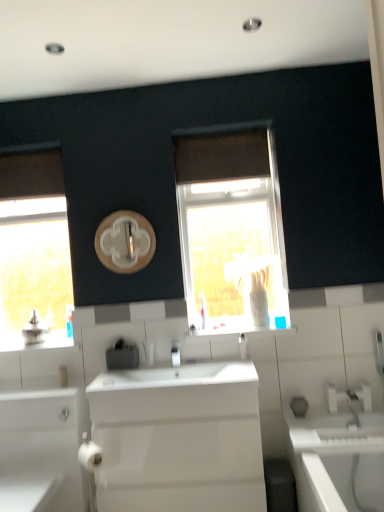
Question: Does white glossy window sill at center have a larger size compared to white glossy bathtub at lower right?

Choices:
 (A) no
 (B) yes

Answer: (A)

Question: From the image's perspective, is white glossy window sill at center beneath white glossy bathtub at lower right?

Choices:
 (A) yes
 (B) no

Answer: (B)

Question: Is white glossy window sill at center positioned before white glossy bathtub at lower right?

Choices:
 (A) yes
 (B) no

Answer: (B)

Question: Is white glossy window sill at center far from white glossy bathtub at lower right?

Choices:
 (A) no
 (B) yes

Answer: (A)

Question: From a real-world perspective, is white glossy window sill at center beneath white glossy bathtub at lower right?

Choices:
 (A) no
 (B) yes

Answer: (A)

Question: Looking at the image, does white glossy window sill at center seem bigger or smaller compared to white glossy cabinet at lower left?

Choices:
 (A) big
 (B) small

Answer: (B)

Question: From the image's perspective, is white glossy window sill at center above or below white glossy cabinet at lower left?

Choices:
 (A) above
 (B) below

Answer: (A)

Question: Does point (283, 318) appear closer or farther from the camera than point (51, 439)?

Choices:
 (A) farther
 (B) closer

Answer: (A)

Question: Considering the relative positions of white glossy window sill at center and white glossy cabinet at lower left in the image provided, is white glossy window sill at center to the left or to the right of white glossy cabinet at lower left?

Choices:
 (A) left
 (B) right

Answer: (B)

Question: From the image's perspective, relative to white glossy sink at center, is wooden circle at center above or below?

Choices:
 (A) below
 (B) above

Answer: (B)

Question: Is wooden circle at center inside or outside of white glossy sink at center?

Choices:
 (A) inside
 (B) outside

Answer: (B)

Question: Based on their positions, is wooden circle at center located to the left or right of white glossy sink at center?

Choices:
 (A) right
 (B) left

Answer: (B)

Question: Is point (105, 231) closer or farther from the camera than point (170, 463)?

Choices:
 (A) closer
 (B) farther

Answer: (B)

Question: In the image, is translucent glass window at center, which is the 2th window in left-to-right order, positioned in front of or behind white glossy bathtub at lower right?

Choices:
 (A) front
 (B) behind

Answer: (B)

Question: Is point (183, 160) closer or farther from the camera than point (359, 451)?

Choices:
 (A) closer
 (B) farther

Answer: (B)